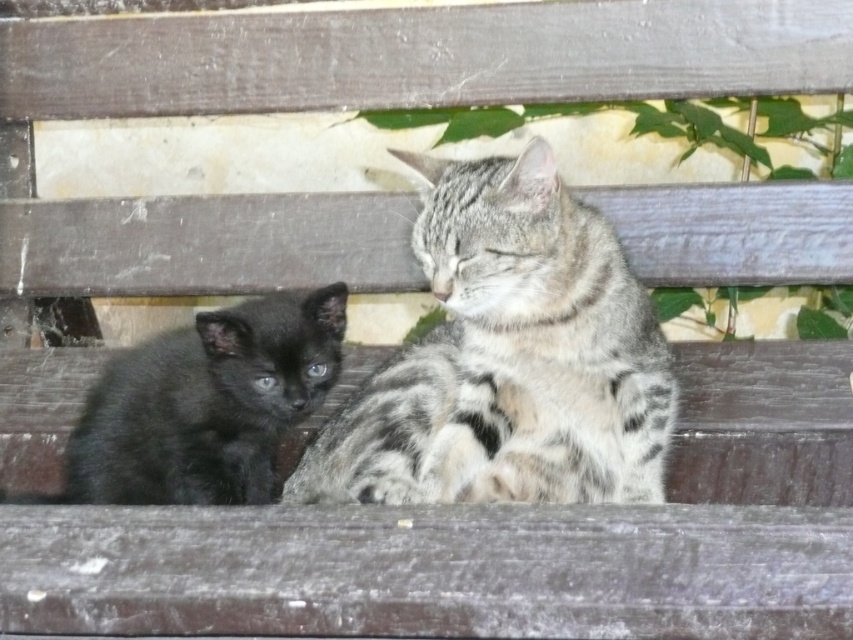
This screenshot has height=640, width=853. What do you see at coordinates (508, 358) in the screenshot? I see `gray striped cat at center` at bounding box center [508, 358].

Can you confirm if gray striped cat at center is wider than black fur kitten at left?

Indeed, gray striped cat at center has a greater width compared to black fur kitten at left.

Which is in front, point (503, 356) or point (73, 460)?

Point (503, 356) is more forward.

Locate an element on the screen. Image resolution: width=853 pixels, height=640 pixels. gray striped cat at center is located at coordinates (508, 358).